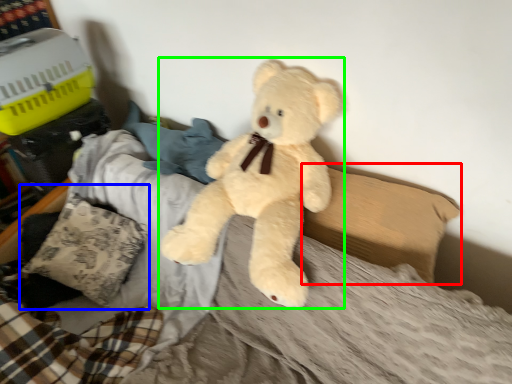
Question: Considering the real-world distances, which object is closest to pillow (highlighted by a red box)? pillow (highlighted by a blue box) or teddy bear (highlighted by a green box).

Choices:
 (A) pillow
 (B) teddy bear

Answer: (B)